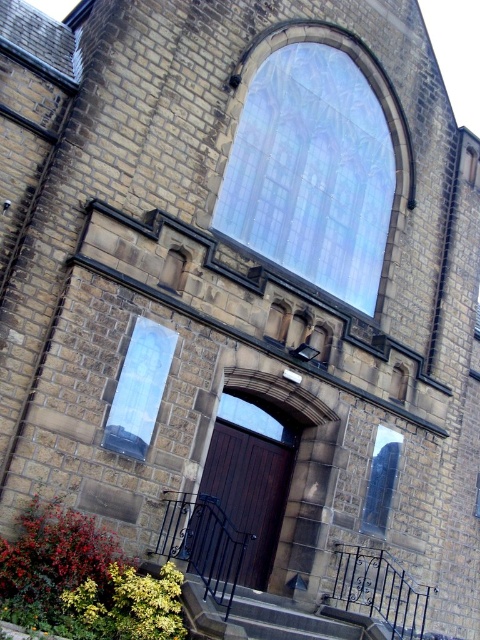
Question: Does dark wood door at center appear under transparent glass window at center?

Choices:
 (A) yes
 (B) no

Answer: (A)

Question: Which object is farther from the camera taking this photo?

Choices:
 (A) transparent glass window at center
 (B) clear glass window at center
 (C) stained glass window at upper center
 (D) dark wood door at center

Answer: (A)

Question: Which point appears farthest from the camera in this image?

Choices:
 (A) (275, 499)
 (B) (135, 420)

Answer: (A)

Question: Is dark wood door at center above black wrought iron stairs at lower center?

Choices:
 (A) no
 (B) yes

Answer: (B)

Question: Which object appears farthest from the camera in this image?

Choices:
 (A) clear glass window at center
 (B) transparent glass window at center
 (C) dark wood door at center
 (D) black wrought iron stairs at lower center

Answer: (B)

Question: Is clear glass window at center bigger than transparent glass window at center?

Choices:
 (A) no
 (B) yes

Answer: (B)